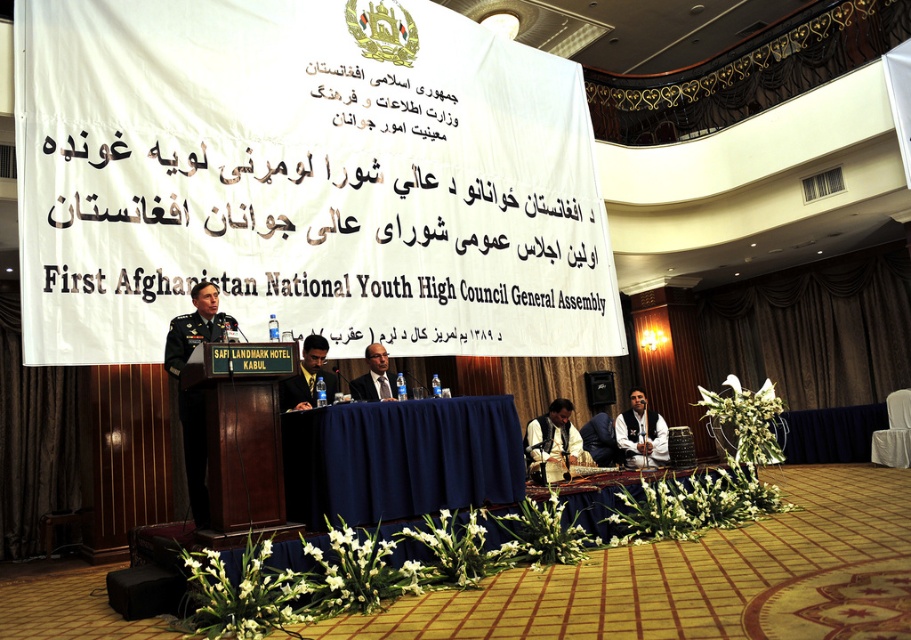
Question: Does green military uniform at left appear under dark green fabric uniform at center?

Choices:
 (A) no
 (B) yes

Answer: (A)

Question: Does blue fabric table at center have a larger size compared to dark green fabric uniform at center?

Choices:
 (A) no
 (B) yes

Answer: (B)

Question: Which object is positioned farthest from the matte black suit at center?

Choices:
 (A) dark green military uniform at center
 (B) blue fabric table at center
 (C) dark green fabric uniform at center

Answer: (C)

Question: Among these objects, which one is nearest to the camera?

Choices:
 (A) matte black suit at center
 (B) white fabric shirt at center
 (C) green military uniform at left
 (D) dark green fabric uniform at center

Answer: (C)

Question: Which point is closer to the camera taking this photo?

Choices:
 (A) (560, 408)
 (B) (292, 381)
 (C) (353, 468)

Answer: (C)

Question: Where is green military uniform at left located in relation to dark green military uniform at center in the image?

Choices:
 (A) below
 (B) above

Answer: (A)